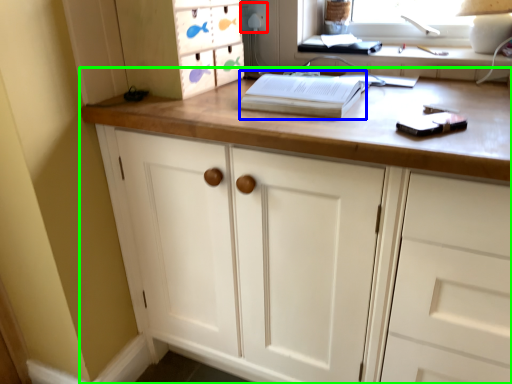
Question: Estimate the real-world distances between objects in this image. Which object is farther from electric outlet (highlighted by a red box), paperback book (highlighted by a blue box) or chest of drawers (highlighted by a green box)?

Choices:
 (A) paperback book
 (B) chest of drawers

Answer: (B)